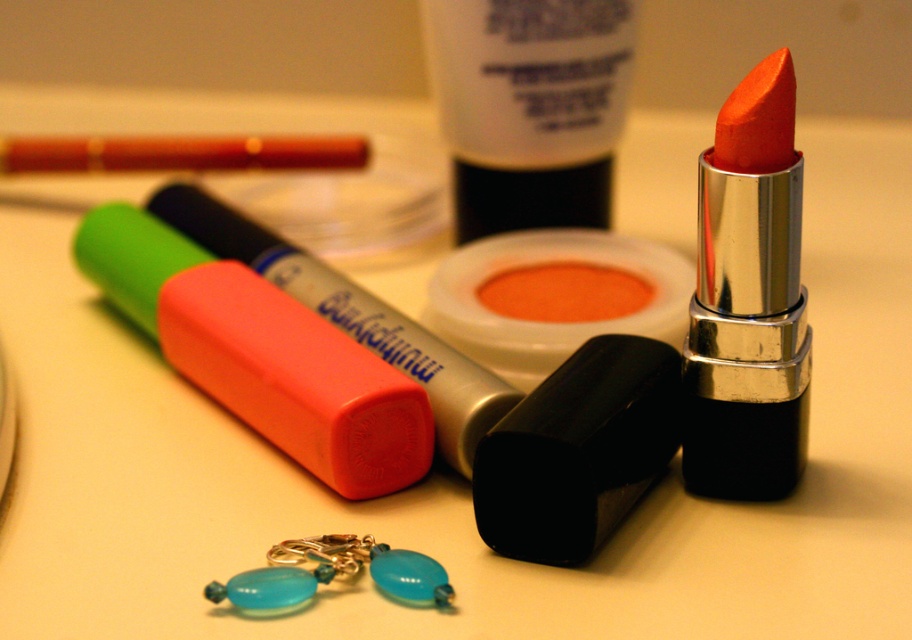
Question: Estimate the real-world distances between objects in this image. Which object is closer to the matte orange lip balm at center?

Choices:
 (A) orange matte lipstick at center
 (B) rubberized plastic highlighter at center

Answer: (B)

Question: Is the position of orange matte lipstick at center more distant than that of matte orange crayon at upper left?

Choices:
 (A) no
 (B) yes

Answer: (A)

Question: Does orange matte lipstick at center lie behind matte orange lip balm at center?

Choices:
 (A) no
 (B) yes

Answer: (A)

Question: Which object is closer to the camera taking this photo?

Choices:
 (A) orange matte lipstick at center
 (B) matte orange lip balm at center
 (C) matte orange crayon at upper left
 (D) rubberized plastic highlighter at center

Answer: (A)

Question: Which point is closer to the camera?

Choices:
 (A) matte orange lip balm at center
 (B) matte orange crayon at upper left
 (C) rubberized plastic highlighter at center
 (D) orange matte lipstick at center

Answer: (D)

Question: In this image, where is orange matte lipstick at center located relative to matte orange crayon at upper left?

Choices:
 (A) right
 (B) left

Answer: (A)